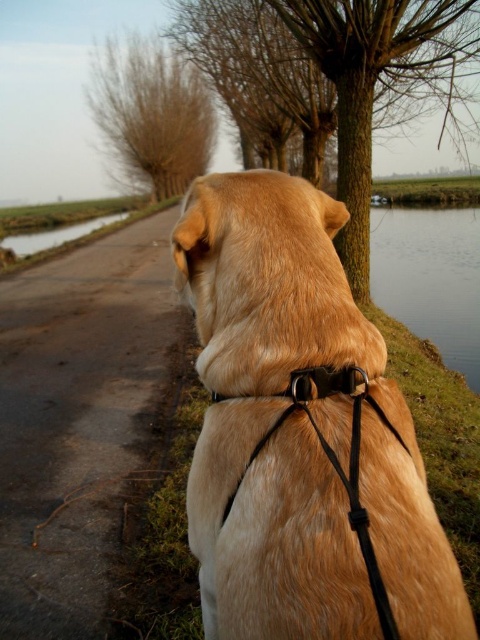
Question: Can you confirm if golden fur dog at center is positioned above brown textured tree at center?

Choices:
 (A) yes
 (B) no

Answer: (B)

Question: Which object appears farthest from the camera in this image?

Choices:
 (A) green grassy waterway at left
 (B) brown textured tree at center
 (C) clear water at right
 (D) dark asphalt road at center

Answer: (A)

Question: Which of the following is the closest to the observer?

Choices:
 (A) (310, 380)
 (B) (288, 541)

Answer: (B)

Question: Does brown textured tree at center come behind black leather neckband at center?

Choices:
 (A) yes
 (B) no

Answer: (A)

Question: Which point appears farthest from the camera in this image?

Choices:
 (A) (0, 416)
 (B) (299, 12)

Answer: (B)

Question: From the image, what is the correct spatial relationship of golden fur dog at center in relation to green grassy waterway at left?

Choices:
 (A) right
 (B) left

Answer: (A)